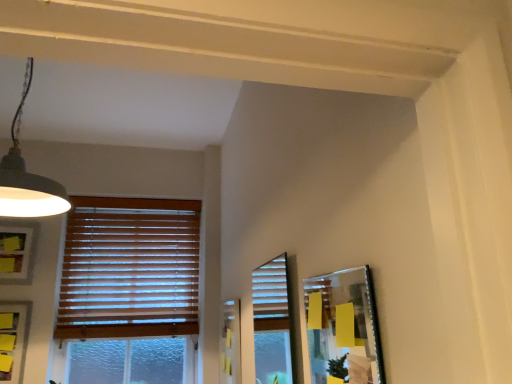
Question: From a real-world perspective, is matte gray picture frame at lower left, which appears as the second picture frame when viewed from the right, positioned above or below metallic silver picture frame at right, which is the 3th picture frame in back-to-front order?

Choices:
 (A) below
 (B) above

Answer: (A)

Question: In terms of size, does matte gray picture frame at lower left, the 2th picture frame in the left-to-right sequence, appear bigger or smaller than metallic silver picture frame at right, placed as the 3th picture frame when sorted from left to right?

Choices:
 (A) small
 (B) big

Answer: (A)

Question: Considering the real-world distances, which object is closest to the metallic silver picture frame at right, marked as the first picture frame in a front-to-back arrangement?

Choices:
 (A) matte white picture frame at left, positioned as the 3th picture frame in right-to-left order
 (B) matte gray picture frame at lower left, the 2th picture frame in the left-to-right sequence
 (C) wooden blinds at left
 (D) matte black lampshade at upper left

Answer: (D)

Question: Which object is positioned closest to the matte black lampshade at upper left?

Choices:
 (A) matte white picture frame at left, the 3th picture frame viewed from the front
 (B) wooden blinds at left
 (C) metallic silver picture frame at right, placed as the 3th picture frame when sorted from left to right
 (D) matte gray picture frame at lower left, which appears as the second picture frame when viewed from the right

Answer: (A)